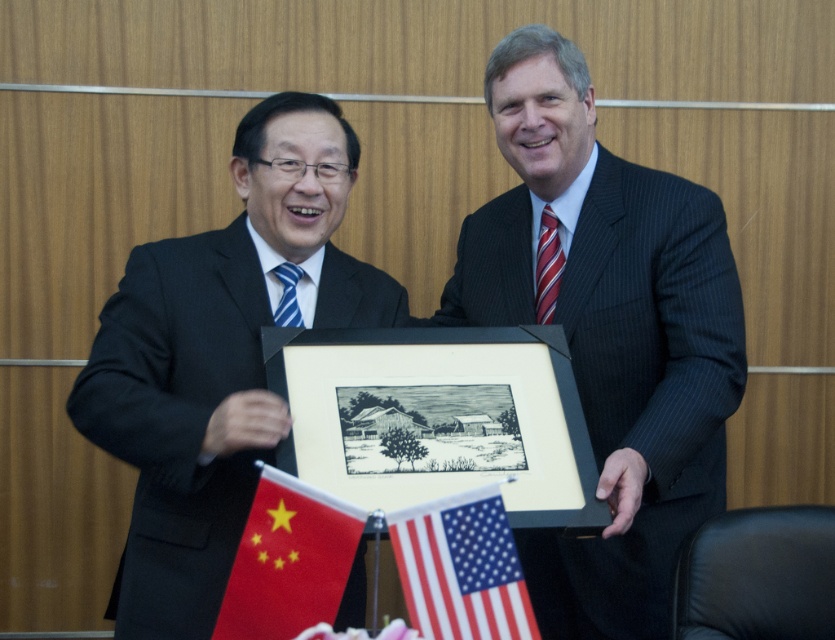
You are a photographer taking a picture of the scene described. You need to focus on the black matte picture frame at center and the red fabric flag at lower left. Which object should you adjust your camera focus on first to ensure it is in sharp focus?

The black matte picture frame at center is closer to the viewer than the red fabric flag at lower left, so you should focus on the black matte picture frame at center first to ensure proper depth of field.